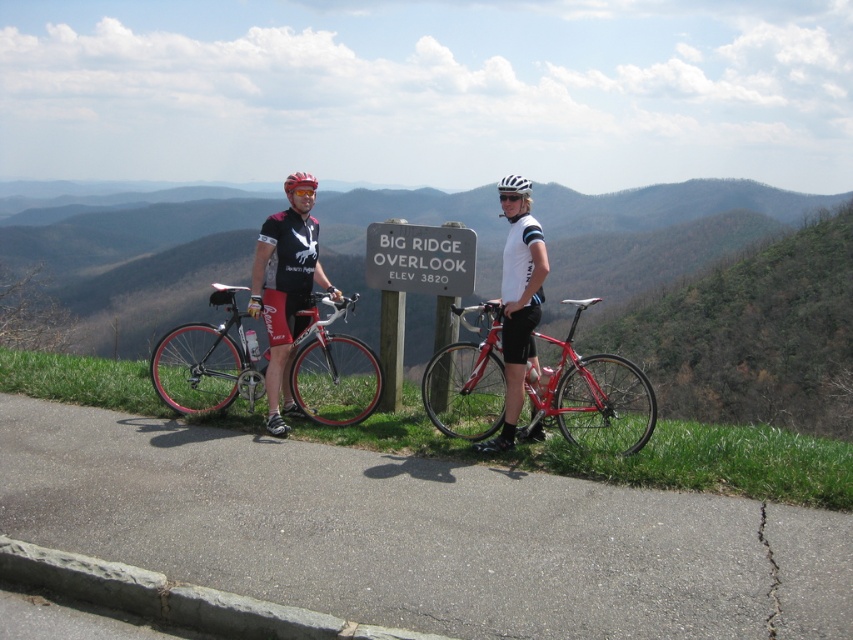
Question: Estimate the real-world distances between objects in this image. Which object is closer to the shiny red bicycle at center?

Choices:
 (A) matte black jersey at center
 (B) shiny metallic bicycle at center
 (C) metallic gray sign at center
 (D) matte black helmet at center

Answer: (C)

Question: Is shiny metallic bicycle at center behind metallic gray sign at center?

Choices:
 (A) no
 (B) yes

Answer: (A)

Question: Is shiny metallic bicycle at center further to the viewer compared to matte black helmet at center?

Choices:
 (A) no
 (B) yes

Answer: (B)

Question: Which point is closer to the camera?

Choices:
 (A) matte black jersey at center
 (B) metallic gray sign at center
 (C) shiny red bicycle at center
 (D) matte black helmet at center

Answer: (C)

Question: Which object is closer to the camera taking this photo?

Choices:
 (A) matte black jersey at center
 (B) matte black helmet at center
 (C) shiny red bicycle at center

Answer: (C)

Question: Observing the image, what is the correct spatial positioning of matte black jersey at center in reference to metallic gray sign at center?

Choices:
 (A) above
 (B) below

Answer: (B)